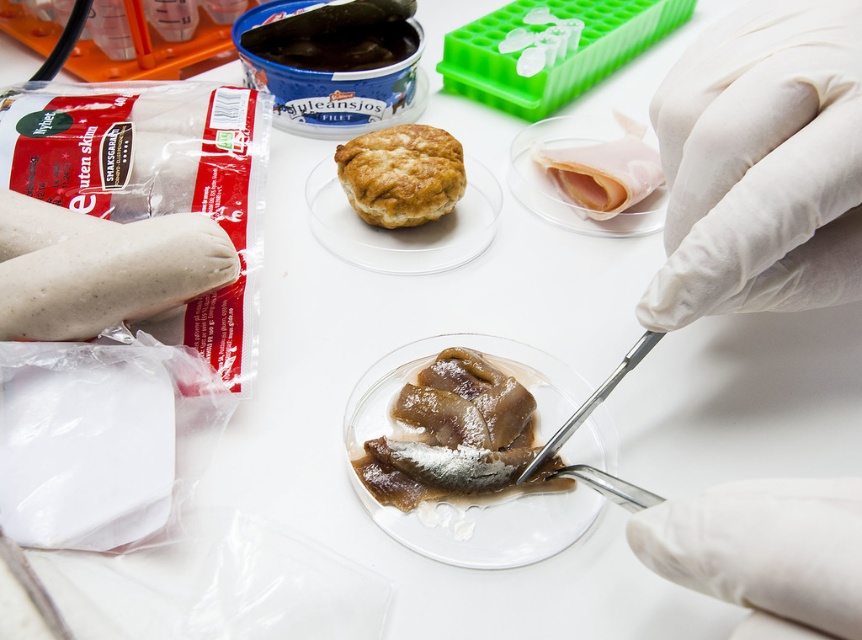
Question: Can you confirm if white latex glove at upper right is wider than golden brown flaky biscuit at center?

Choices:
 (A) no
 (B) yes

Answer: (B)

Question: Is white smooth glove at center bigger than translucent plastic plate at center?

Choices:
 (A) yes
 (B) no

Answer: (B)

Question: Which point is closer to the camera?

Choices:
 (A) golden brown matte glass plate at center
 (B) white smooth glove at center
 (C) translucent gelatinous fish at center

Answer: (B)

Question: Can you confirm if white latex glove at upper right is smaller than white smooth glove at center?

Choices:
 (A) yes
 (B) no

Answer: (B)

Question: Which of the following is the farthest from the observer?

Choices:
 (A) white smooth glove at center
 (B) white smooth glove at upper right
 (C) golden brown flaky biscuit at center

Answer: (C)

Question: Considering the real-world distances, which object is farthest from the translucent gelatinous fish at center?

Choices:
 (A) white smooth glove at upper right
 (B) white latex glove at upper right

Answer: (B)